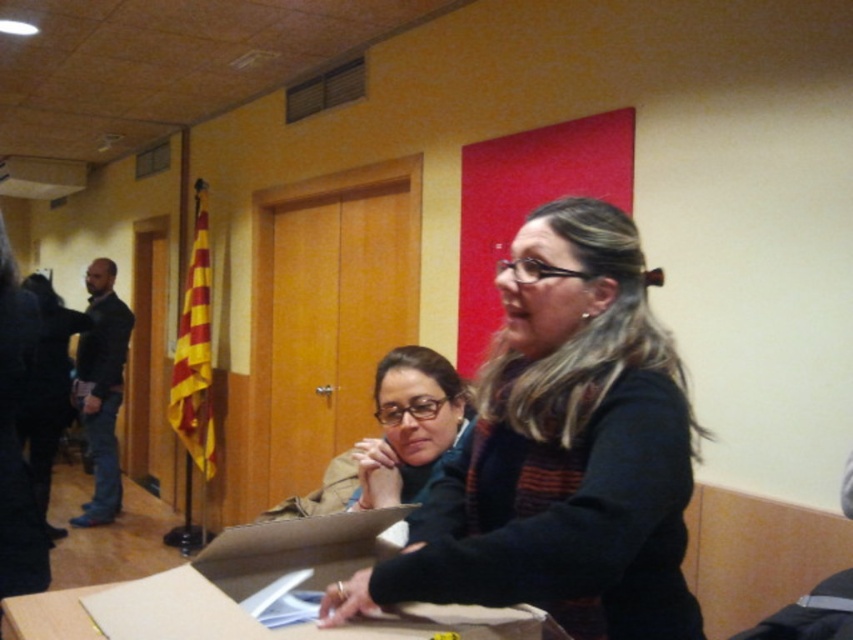
Question: Which object is closer to the camera taking this photo?

Choices:
 (A) matte black glasses at center
 (B) black sweater at center

Answer: (B)

Question: Where is brown cardboard box at center located in relation to matte black glasses at center in the image?

Choices:
 (A) left
 (B) right

Answer: (A)

Question: Is black sweater at center to the left of brown cardboard box at center from the viewer's perspective?

Choices:
 (A) no
 (B) yes

Answer: (A)

Question: Which point is closer to the camera?

Choices:
 (A) brown cardboard box at center
 (B) black sweater at center
 (C) matte black glasses at center

Answer: (B)

Question: Estimate the real-world distances between objects in this image. Which object is farther from the matte black glasses at center?

Choices:
 (A) black sweater at center
 (B) brown cardboard box at center

Answer: (A)

Question: Can you confirm if black sweater at center is positioned above brown cardboard box at center?

Choices:
 (A) yes
 (B) no

Answer: (A)